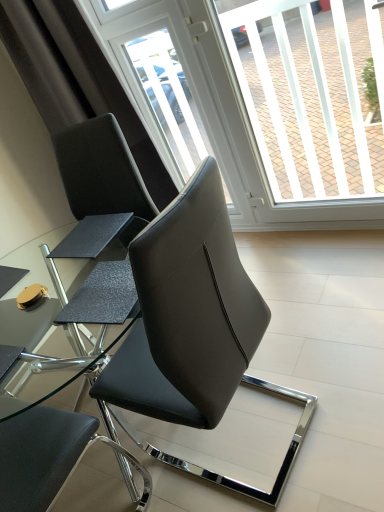
Locate an element on the screen. This screenshot has width=384, height=512. free space in front of transparent glass window screen at upper center is located at coordinates (341, 278).